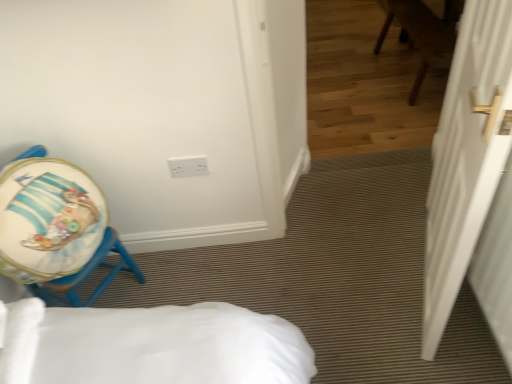
Question: Is matte blue stool at left at the back of white matte door at right?

Choices:
 (A) yes
 (B) no

Answer: (B)

Question: Considering the relative sizes of white matte door at right and matte blue stool at left in the image provided, is white matte door at right shorter than matte blue stool at left?

Choices:
 (A) no
 (B) yes

Answer: (A)

Question: From the image's perspective, would you say white matte door at right is shown under matte blue stool at left?

Choices:
 (A) no
 (B) yes

Answer: (A)

Question: Considering the relative positions of white matte door at right and matte blue stool at left in the image provided, is white matte door at right to the left of matte blue stool at left from the viewer's perspective?

Choices:
 (A) no
 (B) yes

Answer: (A)

Question: Is white matte door at right smaller than matte blue stool at left?

Choices:
 (A) yes
 (B) no

Answer: (B)

Question: From a real-world perspective, is white matte door at right physically located above or below matte blue stool at left?

Choices:
 (A) above
 (B) below

Answer: (A)

Question: In terms of height, does white matte door at right look taller or shorter compared to matte blue stool at left?

Choices:
 (A) tall
 (B) short

Answer: (A)

Question: From the image's perspective, is white matte door at right above or below matte blue stool at left?

Choices:
 (A) above
 (B) below

Answer: (A)

Question: Is white matte door at right wider or thinner than matte blue stool at left?

Choices:
 (A) thin
 (B) wide

Answer: (A)

Question: Based on their positions, is white matte door at right located to the left or right of white plastic electric outlet at upper center?

Choices:
 (A) right
 (B) left

Answer: (A)

Question: Looking at their shapes, would you say white matte door at right is wider or thinner than white plastic electric outlet at upper center?

Choices:
 (A) wide
 (B) thin

Answer: (A)

Question: From the image's perspective, is white matte door at right above or below white plastic electric outlet at upper center?

Choices:
 (A) below
 (B) above

Answer: (A)

Question: Is white matte door at right bigger or smaller than white plastic electric outlet at upper center?

Choices:
 (A) small
 (B) big

Answer: (B)

Question: From the image's perspective, is matte blue stool at left above or below white matte door at right?

Choices:
 (A) below
 (B) above

Answer: (A)

Question: Considering the positions of matte blue stool at left and white matte door at right in the image, is matte blue stool at left wider or thinner than white matte door at right?

Choices:
 (A) thin
 (B) wide

Answer: (B)